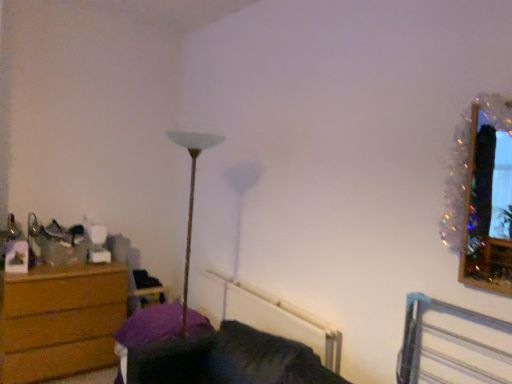
Question: Considering the relative positions of wooden swivel chair at left and metallic silver bed frame at lower right in the image provided, is wooden swivel chair at left in front of metallic silver bed frame at lower right?

Choices:
 (A) no
 (B) yes

Answer: (A)

Question: Is wooden swivel chair at left facing away from metallic silver bed frame at lower right?

Choices:
 (A) no
 (B) yes

Answer: (A)

Question: Is wooden swivel chair at left oriented towards metallic silver bed frame at lower right?

Choices:
 (A) no
 (B) yes

Answer: (B)

Question: Is wooden swivel chair at left outside metallic silver bed frame at lower right?

Choices:
 (A) no
 (B) yes

Answer: (B)

Question: Can you confirm if wooden swivel chair at left is positioned to the right of metallic silver bed frame at lower right?

Choices:
 (A) yes
 (B) no

Answer: (B)

Question: From the image's perspective, is wooden swivel chair at left positioned above or below metallic silver bed frame at lower right?

Choices:
 (A) above
 (B) below

Answer: (B)

Question: Is point (137, 283) positioned closer to the camera than point (458, 311)?

Choices:
 (A) farther
 (B) closer

Answer: (A)

Question: In terms of height, does wooden swivel chair at left look taller or shorter compared to metallic silver bed frame at lower right?

Choices:
 (A) short
 (B) tall

Answer: (B)

Question: Would you say wooden swivel chair at left is inside or outside metallic silver bed frame at lower right?

Choices:
 (A) inside
 (B) outside

Answer: (B)

Question: In terms of height, does sparkly tinsel picture frame at upper right look taller or shorter compared to wooden swivel chair at left?

Choices:
 (A) short
 (B) tall

Answer: (B)

Question: Relative to wooden swivel chair at left, is sparkly tinsel picture frame at upper right in front or behind?

Choices:
 (A) front
 (B) behind

Answer: (A)

Question: From a real-world perspective, is sparkly tinsel picture frame at upper right above or below wooden swivel chair at left?

Choices:
 (A) above
 (B) below

Answer: (A)

Question: From the image's perspective, is sparkly tinsel picture frame at upper right above or below wooden swivel chair at left?

Choices:
 (A) below
 (B) above

Answer: (B)

Question: Considering the positions of wooden swivel chair at left and white plastic radiator at lower center in the image, is wooden swivel chair at left wider or thinner than white plastic radiator at lower center?

Choices:
 (A) thin
 (B) wide

Answer: (B)

Question: From the image's perspective, is wooden swivel chair at left positioned above or below white plastic radiator at lower center?

Choices:
 (A) below
 (B) above

Answer: (B)